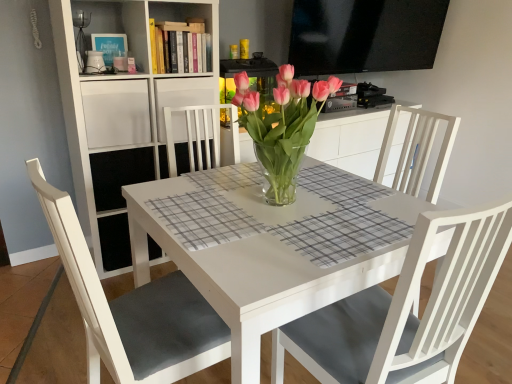
The width and height of the screenshot is (512, 384). Describe the element at coordinates (282, 127) in the screenshot. I see `pink glass vase at center` at that location.

Describe the element at coordinates (116, 112) in the screenshot. I see `white matte shelf at upper left, which appears as the 2th shelf when ordered from the bottom` at that location.

In order to click on white matte chair at lower left in this screenshot , I will do `click(133, 309)`.

How much distance is there between white matte shelf at upper left, the 2th shelf from the top, and white wood shelf at upper center, the 3th shelf positioned from the bottom?

white matte shelf at upper left, the 2th shelf from the top, is 20.28 centimeters from white wood shelf at upper center, the 3th shelf positioned from the bottom.

Based on the photo, considering the relative sizes of white matte shelf at upper left, the 2th shelf from the top, and white wood shelf at upper center, placed as the 1th shelf when sorted from top to bottom, in the image provided, is white matte shelf at upper left, the 2th shelf from the top, bigger than white wood shelf at upper center, placed as the 1th shelf when sorted from top to bottom,?

No, white matte shelf at upper left, the 2th shelf from the top, is not bigger than white wood shelf at upper center, placed as the 1th shelf when sorted from top to bottom.

From the image's perspective, is white matte shelf at upper left, the 2th shelf from the top, located above white wood shelf at upper center, placed as the 1th shelf when sorted from top to bottom?

Incorrect, from the image's perspective, white matte shelf at upper left, the 2th shelf from the top, is lower than white wood shelf at upper center, placed as the 1th shelf when sorted from top to bottom.

From a real-world perspective, is white matte shelf at upper left, which appears as the 2th shelf when ordered from the bottom, above or below white wood shelf at upper center, placed as the 1th shelf when sorted from top to bottom?

white matte shelf at upper left, which appears as the 2th shelf when ordered from the bottom, is above white wood shelf at upper center, placed as the 1th shelf when sorted from top to bottom.

This screenshot has width=512, height=384. In order to click on floral arrangement positioned vertically above the white glossy table at center (from a real-world perspective) in this screenshot , I will do `click(282, 127)`.

Is white glossy table at center thinner than pink glass vase at center?

No, white glossy table at center is not thinner than pink glass vase at center.

Which object is closer to the camera, white glossy table at center or pink glass vase at center?

white glossy table at center is closer to the camera.

Is white glossy table at center smaller than white matte shelf at upper left, the 2th shelf from the top?

No.

Which object is further away from the camera, white glossy table at center or white matte shelf at upper left, the 2th shelf from the top?

white matte shelf at upper left, the 2th shelf from the top, is more distant.

Consider the image. How many degrees apart are the facing directions of white glossy table at center and white matte shelf at upper left, the 2th shelf from the top?

2.77 degrees.

Does white glossy table at center turn towards white matte shelf at upper left, which appears as the 2th shelf when ordered from the bottom?

No, white glossy table at center is not turned towards white matte shelf at upper left, which appears as the 2th shelf when ordered from the bottom.

Does pink glass vase at center contain white matte bookshelf at upper left, which is counted as the 3th shelf, starting from the top?

That's incorrect, white matte bookshelf at upper left, which is counted as the 3th shelf, starting from the top, is not inside pink glass vase at center.

From a real-world perspective, starting from the pink glass vase at center, which shelf is the 3rd one below it? Please provide its 2D coordinates.

[(122, 115)]

Considering the relative sizes of pink glass vase at center and white matte bookshelf at upper left, which is the 1th shelf in bottom-to-top order, in the image provided, is pink glass vase at center shorter than white matte bookshelf at upper left, which is the 1th shelf in bottom-to-top order,?

Indeed, pink glass vase at center has a lesser height compared to white matte bookshelf at upper left, which is the 1th shelf in bottom-to-top order.

Between point (297, 90) and point (104, 204), which one is positioned behind?

The point (104, 204) is more distant.

Would you say white matte chair at lower left is to the left or to the right of white glossy table at center in the picture?

Based on their positions, white matte chair at lower left is located to the left of white glossy table at center.

Could white glossy table at center be considered to be inside white matte chair at lower left?

No, white glossy table at center is not inside white matte chair at lower left.

Measure the distance between white matte chair at lower left and white glossy table at center.

12.70 inches.

Considering the relative sizes of white matte shelf at upper left, which appears as the 2th shelf when ordered from the bottom, and white matte chair at lower left in the image provided, is white matte shelf at upper left, which appears as the 2th shelf when ordered from the bottom, shorter than white matte chair at lower left?

Correct, white matte shelf at upper left, which appears as the 2th shelf when ordered from the bottom, is not as tall as white matte chair at lower left.

Find the location of a particular element. This screenshot has height=384, width=512. chair that is below the white matte shelf at upper left, which appears as the 2th shelf when ordered from the bottom (from the image's perspective) is located at coordinates (133, 309).

Could you tell me if white matte shelf at upper left, which appears as the 2th shelf when ordered from the bottom, is turned towards white matte chair at lower left?

Yes, white matte shelf at upper left, which appears as the 2th shelf when ordered from the bottom, is aimed at white matte chair at lower left.

Is white matte shelf at upper left, the 2th shelf from the top, not within white matte chair at lower left?

Yes, white matte shelf at upper left, the 2th shelf from the top, is located beyond the bounds of white matte chair at lower left.

Can you confirm if white wood shelf at upper center, the 3th shelf positioned from the bottom, is bigger than white matte bookshelf at upper left, which is the 1th shelf in bottom-to-top order?

No, white wood shelf at upper center, the 3th shelf positioned from the bottom, is not bigger than white matte bookshelf at upper left, which is the 1th shelf in bottom-to-top order.

Could you tell me if white wood shelf at upper center, the 3th shelf positioned from the bottom, is turned towards white matte bookshelf at upper left, which is counted as the 3th shelf, starting from the top?

Yes, white wood shelf at upper center, the 3th shelf positioned from the bottom, is turned towards white matte bookshelf at upper left, which is counted as the 3th shelf, starting from the top.

The height and width of the screenshot is (384, 512). Identify the location of shelf on the right of white matte bookshelf at upper left, which is counted as the 3th shelf, starting from the top. (181, 96).

I want to click on the 1st shelf in front of the white wood shelf at upper center, the 3th shelf positioned from the bottom, counting from the anchor's position, so click(x=116, y=112).

Where is `table below the pink glass vase at center (from a real-world perspective)`? table below the pink glass vase at center (from a real-world perspective) is located at coordinates (266, 252).

From the image, which object appears to be farther from pink glass vase at center, white matte bookshelf at upper left, which is the 1th shelf in bottom-to-top order, or white wood shelf at upper center, placed as the 1th shelf when sorted from top to bottom?

Based on the image, white matte bookshelf at upper left, which is the 1th shelf in bottom-to-top order, appears to be further to pink glass vase at center.

Which object lies further to the anchor point white glossy table at center, white matte shelf at upper left, which appears as the 2th shelf when ordered from the bottom, or white matte bookshelf at upper left, which is counted as the 3th shelf, starting from the top?

Based on the image, white matte shelf at upper left, which appears as the 2th shelf when ordered from the bottom, appears to be further to white glossy table at center.

Considering their positions, is white matte shelf at upper left, which appears as the 2th shelf when ordered from the bottom, positioned further to white glossy table at center than pink glass vase at center?

The object further to white glossy table at center is white matte shelf at upper left, which appears as the 2th shelf when ordered from the bottom.

Which object lies further to the anchor point pink glass vase at center, white glossy table at center or white matte shelf at upper left, which appears as the 2th shelf when ordered from the bottom?

white matte shelf at upper left, which appears as the 2th shelf when ordered from the bottom, is positioned further to the anchor pink glass vase at center.

Estimate the real-world distances between objects in this image. Which object is further from white matte bookshelf at upper left, which is counted as the 3th shelf, starting from the top, pink glass vase at center or white wood shelf at upper center, the 3th shelf positioned from the bottom?

The object further to white matte bookshelf at upper left, which is counted as the 3th shelf, starting from the top, is pink glass vase at center.

Considering their positions, is white matte chair at lower left positioned closer to white wood shelf at upper center, the 3th shelf positioned from the bottom, than pink glass vase at center?

Based on the image, pink glass vase at center appears to be nearer to white wood shelf at upper center, the 3th shelf positioned from the bottom.

Considering their positions, is pink glass vase at center positioned further to white wood shelf at upper center, placed as the 1th shelf when sorted from top to bottom, than white matte chair at lower left?

white matte chair at lower left.

From the image, which object appears to be nearer to white matte chair at lower left, white matte bookshelf at upper left, which is counted as the 3th shelf, starting from the top, or white glossy table at center?

The object closer to white matte chair at lower left is white glossy table at center.

I want to click on floral arrangement between white glossy table at center and white wood shelf at upper center, the 3th shelf positioned from the bottom, in the front-back direction, so click(x=282, y=127).

Where is `shelf between white matte shelf at upper left, which appears as the 2th shelf when ordered from the bottom, and white wood shelf at upper center, the 3th shelf positioned from the bottom, in the horizontal direction`? This screenshot has width=512, height=384. shelf between white matte shelf at upper left, which appears as the 2th shelf when ordered from the bottom, and white wood shelf at upper center, the 3th shelf positioned from the bottom, in the horizontal direction is located at coordinates (122, 115).

The height and width of the screenshot is (384, 512). What are the coordinates of `floral arrangement between white matte chair at lower left and white wood shelf at upper center, the 3th shelf positioned from the bottom, from front to back` in the screenshot? It's located at (282, 127).

Locate an element on the screen. The height and width of the screenshot is (384, 512). floral arrangement between white matte chair at lower left and white matte bookshelf at upper left, which is counted as the 3th shelf, starting from the top, along the z-axis is located at coordinates (282, 127).